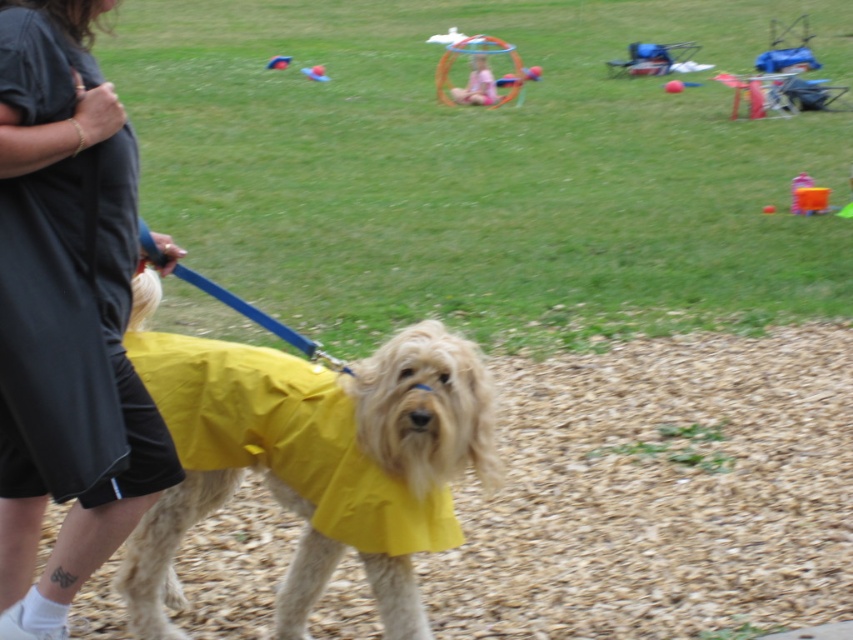
Locate an element on the screen. This screenshot has height=640, width=853. black fabric dress at left is located at coordinates (65, 314).

Does black fabric dress at left have a greater width compared to yellow fabric dog at center?

Incorrect, black fabric dress at left's width does not surpass yellow fabric dog at center's.

Which is in front, point (107, 532) or point (293, 595)?

Point (107, 532)

Locate an element on the screen. The image size is (853, 640). black fabric dress at left is located at coordinates (65, 314).